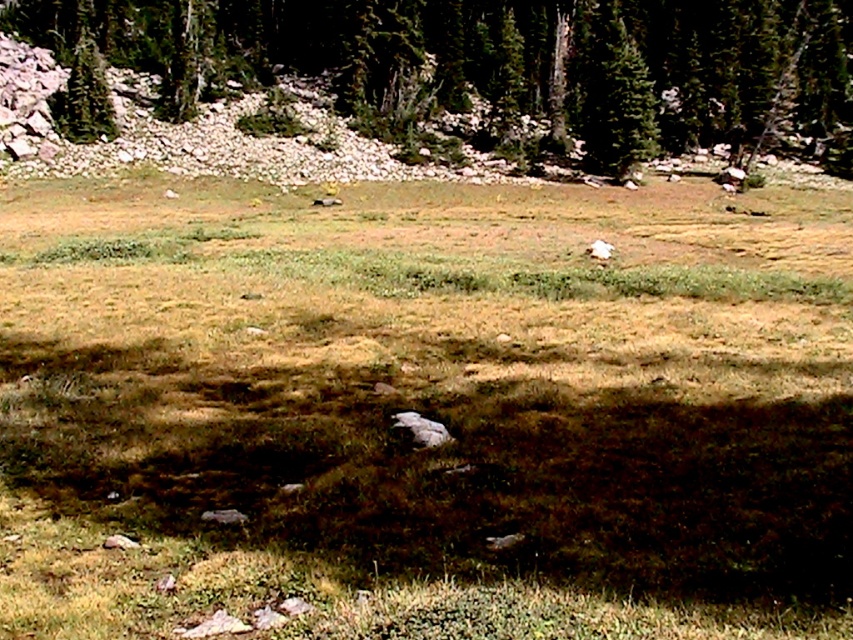
Does green grass at center appear over green textured pine tree at upper center?

No, green grass at center is not above green textured pine tree at upper center.

Image resolution: width=853 pixels, height=640 pixels. I want to click on green grass at center, so click(x=422, y=412).

This screenshot has height=640, width=853. What do you see at coordinates (422, 412) in the screenshot?
I see `green grass at center` at bounding box center [422, 412].

You are a GUI agent. You are given a task and a screenshot of the screen. Output one action in this format:
    pyautogui.click(x=<x>, y=<y>)
    Task: Click on the green grass at center
    The width and height of the screenshot is (853, 640).
    Given the screenshot: What is the action you would take?
    pyautogui.click(x=422, y=412)

Who is more distant from viewer, (193, 390) or (97, 61)?

Positioned behind is point (97, 61).

Consider the image. Can you confirm if green grass at center is bigger than green matte tree at upper left?

Correct, green grass at center is larger in size than green matte tree at upper left.

Who is more distant from viewer, (x=445, y=374) or (x=83, y=99)?

Point (x=83, y=99)

Identify the location of green grass at center. The width and height of the screenshot is (853, 640). (422, 412).

Can you confirm if green grass at center is wider than green textured tree at upper center?

Incorrect, green grass at center's width does not surpass green textured tree at upper center's.

Which is above, green grass at center or green textured tree at upper center?

Positioned higher is green textured tree at upper center.

Identify the location of green grass at center. (422, 412).

Locate an element on the screen. This screenshot has width=853, height=640. green grass at center is located at coordinates pyautogui.click(x=422, y=412).